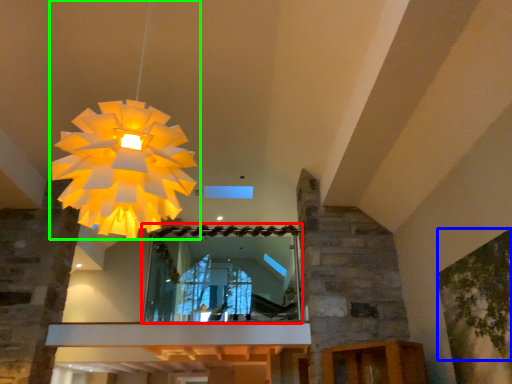
Question: Based on their relative distances, which object is nearer to mirror (highlighted by a red box)? Choose from tree (highlighted by a blue box) and lamp (highlighted by a green box).

Choices:
 (A) tree
 (B) lamp

Answer: (A)